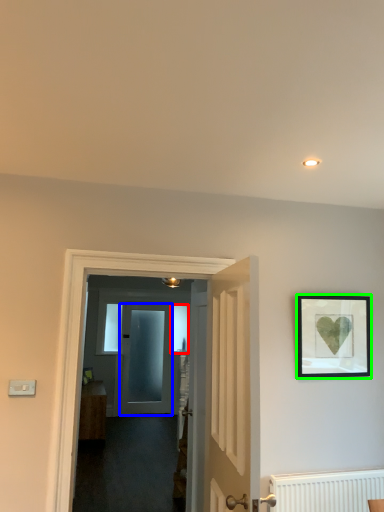
Question: Based on their relative distances, which object is farther from window (highlighted by a red box)? Choose from door (highlighted by a blue box) and picture frame (highlighted by a green box).

Choices:
 (A) door
 (B) picture frame

Answer: (B)